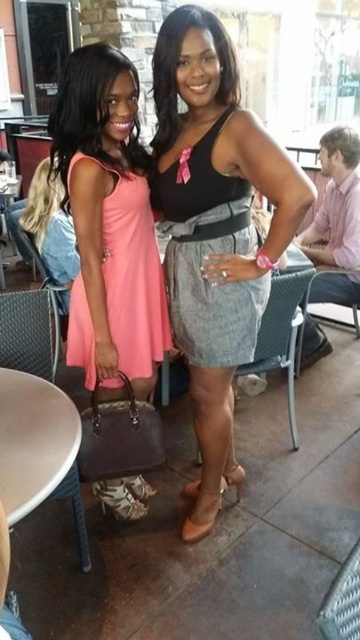
Question: Which point is farther from the camera taking this photo?

Choices:
 (A) 304,332
 (B) 69,301
 (C) 239,312

Answer: (A)

Question: Considering the relative positions of matte pink dress at left and pink fabric shirt at right in the image provided, where is matte pink dress at left located with respect to pink fabric shirt at right?

Choices:
 (A) below
 (B) above

Answer: (A)

Question: Which point is closer to the camera taking this photo?

Choices:
 (A) (142, 397)
 (B) (257, 316)
 (C) (219, 221)

Answer: (C)

Question: Can you confirm if gray textured dress at center is smaller than gray fabric belt at center?

Choices:
 (A) no
 (B) yes

Answer: (A)

Question: Which point is farther to the camera?

Choices:
 (A) (234, 214)
 (B) (138, 204)
 (C) (228, 401)

Answer: (C)

Question: Is gray textured dress at center closer to camera compared to matte pink dress at center?

Choices:
 (A) no
 (B) yes

Answer: (B)